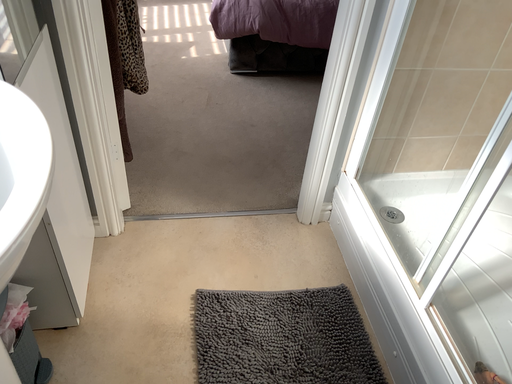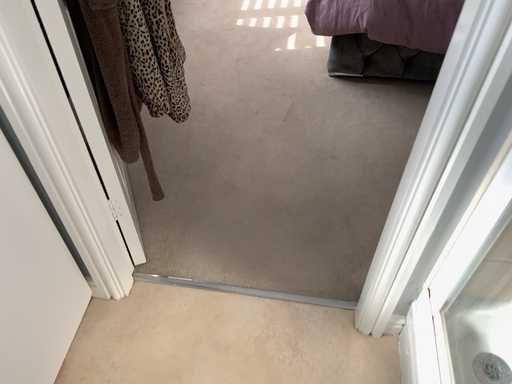
Question: How did the camera likely rotate when shooting the video?

Choices:
 (A) rotated left
 (B) rotated right

Answer: (A)